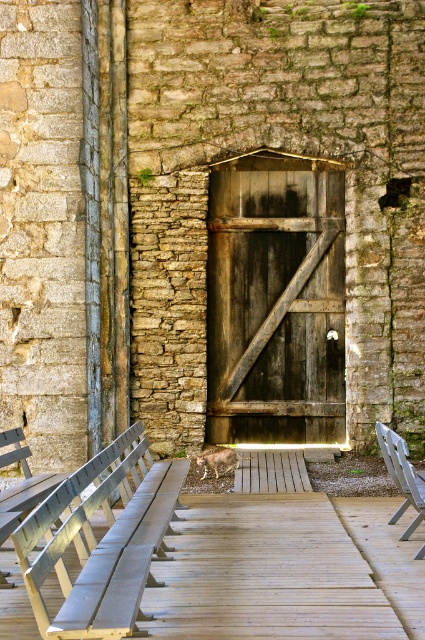
Between wooden bench at lower left and metallic silver bench at center, which one appears on the right side from the viewer's perspective?

From the viewer's perspective, metallic silver bench at center appears more on the right side.

Between wooden bench at lower left and metallic silver bench at center, which one is positioned higher?

wooden bench at lower left is higher up.

Describe the element at coordinates (102, 540) in the screenshot. The width and height of the screenshot is (425, 640). I see `wooden bench at lower left` at that location.

At what (x,y) coordinates should I click in order to perform the action: click on wooden bench at lower left. Please return your answer as a coordinate pair (x, y). This screenshot has height=640, width=425. Looking at the image, I should click on (102, 540).

Consider the image. Is dark brown wooden door at center positioned in front of wooden bench at lower left?

No, dark brown wooden door at center is further to the viewer.

Who is taller, dark brown wooden door at center or wooden bench at lower left?

dark brown wooden door at center

Describe the element at coordinates (275, 300) in the screenshot. This screenshot has width=425, height=640. I see `dark brown wooden door at center` at that location.

Where is `dark brown wooden door at center`? dark brown wooden door at center is located at coordinates (275, 300).

Between dark brown wooden door at center and metallic silver bench at center, which one is positioned lower?

Positioned lower is metallic silver bench at center.

Between point (215, 307) and point (413, 496), which one is positioned behind?

The point (215, 307) is behind.

Find the location of `dark brown wooden door at center`. dark brown wooden door at center is located at coordinates (275, 300).

Locate an element on the screen. Image resolution: width=425 pixels, height=640 pixels. dark brown wooden door at center is located at coordinates (275, 300).